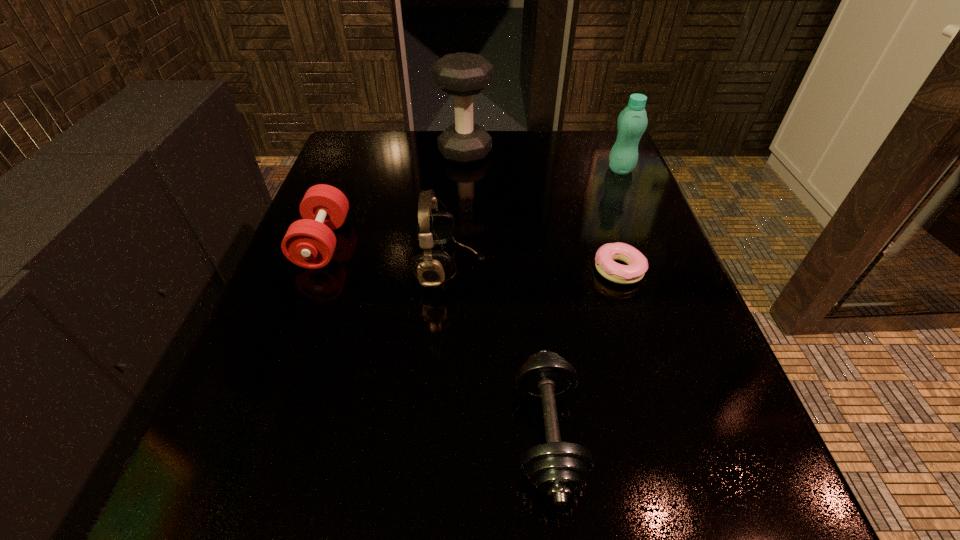
Where is `the tallest dumbbell`? the tallest dumbbell is located at coordinates (463, 75).

Where is `the second dumbbell from right to left`? the second dumbbell from right to left is located at coordinates (463, 75).

Where is `bottle`? The image size is (960, 540). bottle is located at coordinates (632, 122).

The width and height of the screenshot is (960, 540). Find the location of `headset`. headset is located at coordinates pyautogui.click(x=435, y=228).

I want to click on the leftmost dumbbell, so click(310, 242).

Identify the location of the leftmost object. (310, 242).

The image size is (960, 540). In order to click on the rightmost dumbbell in this screenshot , I will do `click(557, 469)`.

At what (x,y) coordinates should I click in order to perform the action: click on the nearest dumbbell. Please return your answer as a coordinate pair (x, y). The height and width of the screenshot is (540, 960). Looking at the image, I should click on (557, 469).

Where is `doughnut`? doughnut is located at coordinates (637, 263).

I want to click on the second object from right to left, so click(637, 263).